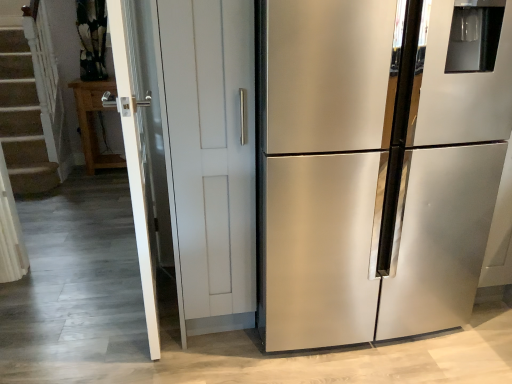
Question: Can you confirm if stainless steel refrigerator at right is wider than white glossy screen door at left?

Choices:
 (A) no
 (B) yes

Answer: (B)

Question: From the image's perspective, is stainless steel refrigerator at right beneath white glossy screen door at left?

Choices:
 (A) yes
 (B) no

Answer: (A)

Question: Does stainless steel refrigerator at right have a larger size compared to white glossy screen door at left?

Choices:
 (A) no
 (B) yes

Answer: (B)

Question: Considering the relative positions of stainless steel refrigerator at right and white glossy screen door at left in the image provided, is stainless steel refrigerator at right in front of white glossy screen door at left?

Choices:
 (A) no
 (B) yes

Answer: (B)

Question: Is stainless steel refrigerator at right further to the viewer compared to white glossy screen door at left?

Choices:
 (A) no
 (B) yes

Answer: (A)

Question: Is white glossy screen door at left taller or shorter than stainless steel refrigerator at right?

Choices:
 (A) tall
 (B) short

Answer: (A)

Question: From a real-world perspective, is white glossy screen door at left positioned above or below stainless steel refrigerator at right?

Choices:
 (A) below
 (B) above

Answer: (A)

Question: Considering the positions of point (151, 344) and point (322, 281), is point (151, 344) closer or farther from the camera than point (322, 281)?

Choices:
 (A) farther
 (B) closer

Answer: (A)

Question: Is white glossy screen door at left in front of or behind stainless steel refrigerator at right in the image?

Choices:
 (A) behind
 (B) front

Answer: (A)

Question: Considering the relative positions of stainless steel refrigerator at right and wooden cabinet at left in the image provided, is stainless steel refrigerator at right to the left or to the right of wooden cabinet at left?

Choices:
 (A) left
 (B) right

Answer: (B)

Question: Looking at their shapes, would you say stainless steel refrigerator at right is wider or thinner than wooden cabinet at left?

Choices:
 (A) thin
 (B) wide

Answer: (B)

Question: From a real-world perspective, is stainless steel refrigerator at right physically located above or below wooden cabinet at left?

Choices:
 (A) above
 (B) below

Answer: (A)

Question: From their relative heights in the image, would you say stainless steel refrigerator at right is taller or shorter than wooden cabinet at left?

Choices:
 (A) tall
 (B) short

Answer: (A)

Question: Looking at their shapes, would you say wooden cabinet at left is wider or thinner than stainless steel refrigerator at right?

Choices:
 (A) wide
 (B) thin

Answer: (B)

Question: From a real-world perspective, is wooden cabinet at left above or below stainless steel refrigerator at right?

Choices:
 (A) below
 (B) above

Answer: (A)